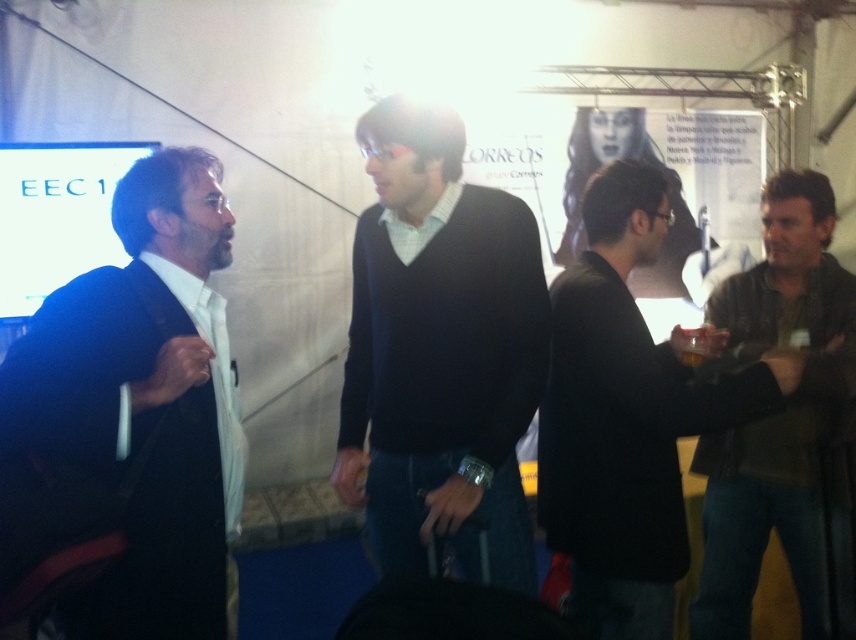
Question: Which of the following is the closest to the observer?

Choices:
 (A) dark blue suit at left
 (B) dark brown leather jacket at right

Answer: (A)

Question: Among these points, which one is farthest from the camera?

Choices:
 (A) [414, 436]
 (B) [545, 150]

Answer: (B)

Question: Can you confirm if leather jacket at right is thinner than white paper poster at center?

Choices:
 (A) yes
 (B) no

Answer: (A)

Question: Which point is closer to the camera?

Choices:
 (A) (207, 394)
 (B) (795, 291)

Answer: (A)

Question: Is dark brown leather jacket at right below white paper poster at center?

Choices:
 (A) yes
 (B) no

Answer: (A)

Question: Can you confirm if dark blue sweater at center is bigger than dark brown leather jacket at right?

Choices:
 (A) yes
 (B) no

Answer: (B)